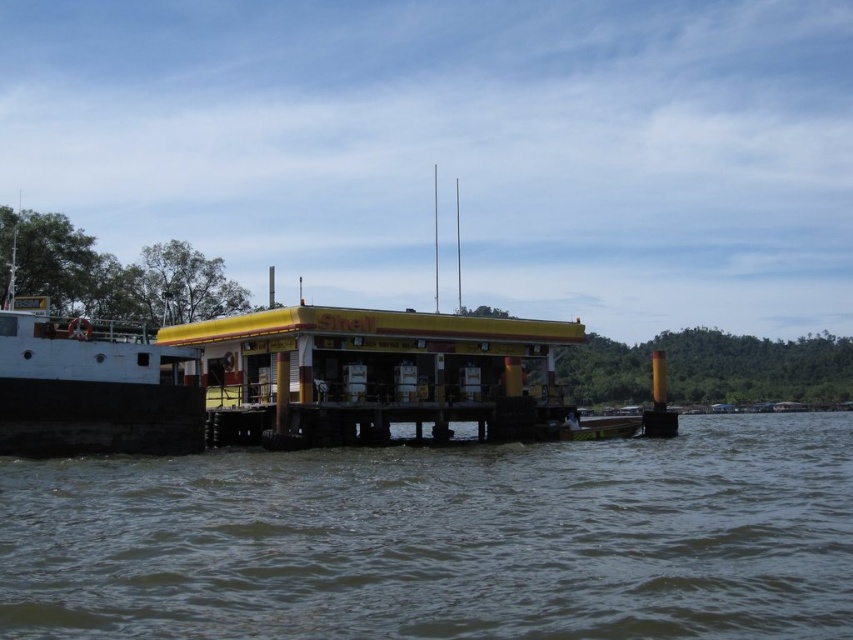
Can you confirm if brown murky water at lower center is shorter than white matte boat at left?

Indeed, brown murky water at lower center has a lesser height compared to white matte boat at left.

Between point (117, 560) and point (80, 429), which one is positioned behind?

The point (80, 429) is more distant.

Which is behind, point (480, 605) or point (32, 401)?

Positioned behind is point (32, 401).

This screenshot has width=853, height=640. In order to click on brown murky water at lower center in this screenshot , I will do `click(444, 540)`.